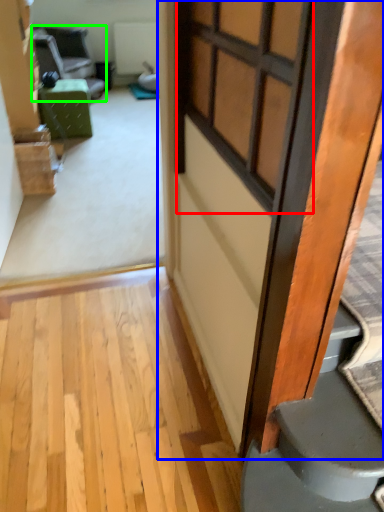
Question: Which object is the farthest from window (highlighted by a red box)? Choose among these: door (highlighted by a blue box) or chair (highlighted by a green box).

Choices:
 (A) door
 (B) chair

Answer: (B)